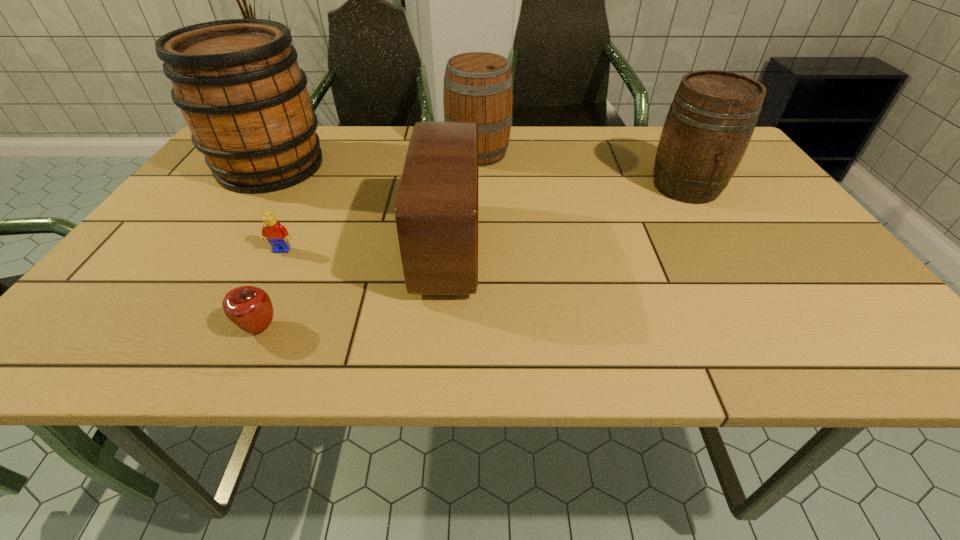
Locate an element on the screen. This screenshot has width=960, height=540. the fifth closest object relative to the nearest object is located at coordinates tap(712, 117).

Locate which cider ranks in proximity to the rightmost object. Please provide its 2D coordinates. Your answer should be formatted as a tuple, i.e. [(x, y)], where the tuple contains the x and y coordinates of a point satisfying the conditions above.

[(478, 87)]

Identify the location of cider object that ranks as the second closest to the apple. (478, 87).

Identify the location of vacant space that satisfies the following two spatial constraints: 1. on the back side of the second cider from right to left; 2. on the right side of the nearest object. The width and height of the screenshot is (960, 540). (340, 153).

Where is `vacant area in the image that satisfies the following two spatial constraints: 1. on the front side of the nearest object; 2. on the right side of the leftmost cider`? Image resolution: width=960 pixels, height=540 pixels. vacant area in the image that satisfies the following two spatial constraints: 1. on the front side of the nearest object; 2. on the right side of the leftmost cider is located at coordinates (163, 328).